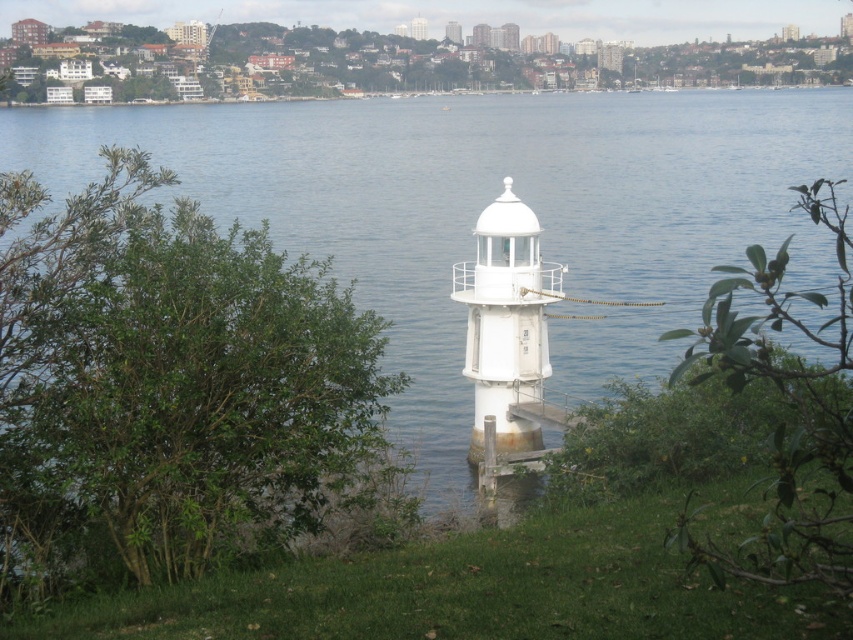
Question: Which object is positioned closest to the transparent water at center?

Choices:
 (A) white smooth tower at center
 (B) white matte/lightweight tower at center

Answer: (A)

Question: Estimate the real-world distances between objects in this image. Which object is closer to the white smooth tower at center?

Choices:
 (A) white matte/lightweight tower at center
 (B) transparent water at center

Answer: (B)

Question: Which object is positioned closest to the white matte/lightweight tower at center?

Choices:
 (A) transparent water at center
 (B) white smooth tower at center

Answer: (A)

Question: Is white matte/lightweight tower at center positioned before white smooth tower at center?

Choices:
 (A) yes
 (B) no

Answer: (A)

Question: Where is transparent water at center located in relation to white smooth tower at center in the image?

Choices:
 (A) below
 (B) above

Answer: (A)

Question: Is white matte/lightweight tower at center thinner than white smooth tower at center?

Choices:
 (A) yes
 (B) no

Answer: (A)